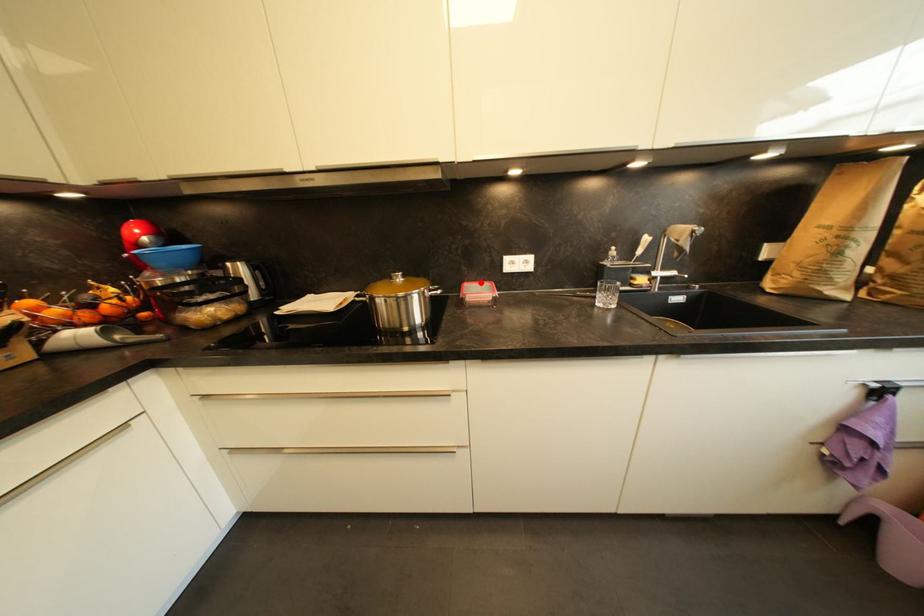
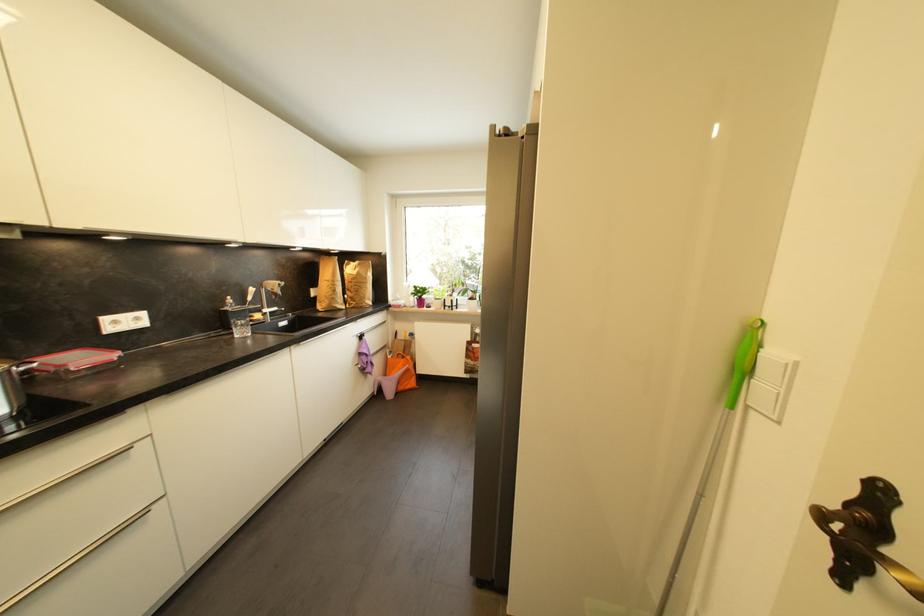
In the second image, find the point that corresponds to the highlighted location in the first image.

(54, 355)